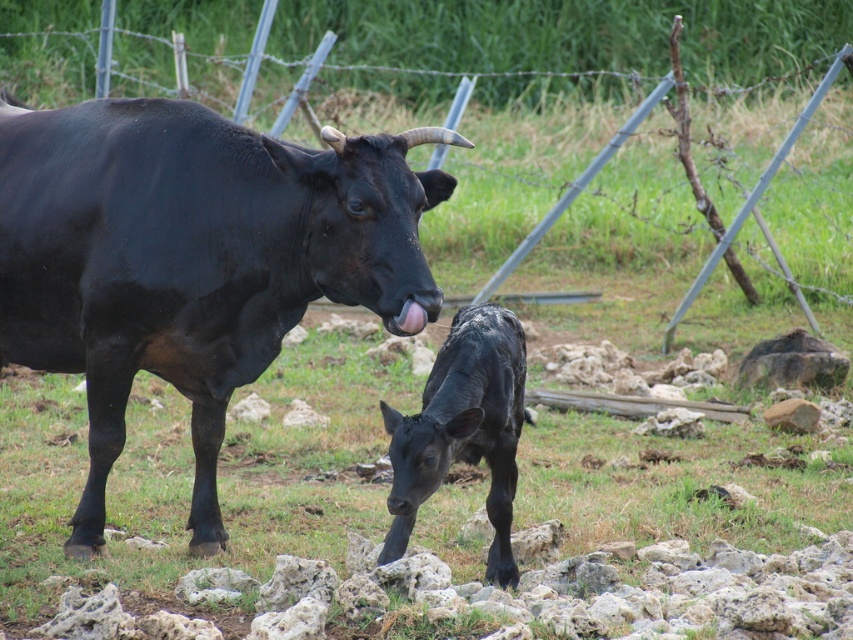
Question: Is shiny black buffalo at upper left further to the viewer compared to black glossy calf at center?

Choices:
 (A) no
 (B) yes

Answer: (A)

Question: Which point is closer to the camera?

Choices:
 (A) (44, 212)
 (B) (498, 337)

Answer: (A)

Question: Can you confirm if shiny black buffalo at upper left is positioned to the left of black glossy calf at center?

Choices:
 (A) no
 (B) yes

Answer: (B)

Question: Can you confirm if shiny black buffalo at upper left is positioned below black glossy calf at center?

Choices:
 (A) yes
 (B) no

Answer: (B)

Question: Which object appears farthest from the camera in this image?

Choices:
 (A) black glossy calf at center
 (B) shiny black buffalo at upper left

Answer: (A)